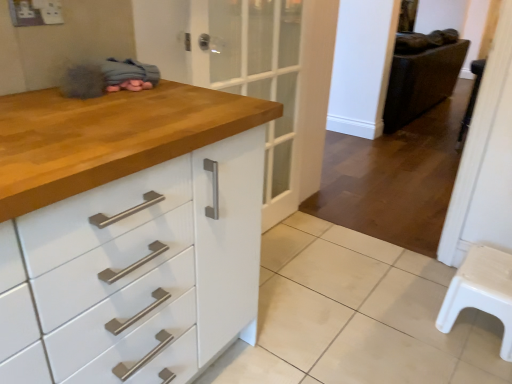
At what (x,y) coordinates should I click in order to perform the action: click on vacant space situated on the left part of white plastic stool at lower right. Please return your answer as a coordinate pair (x, y). This screenshot has width=512, height=384. Looking at the image, I should click on (408, 320).